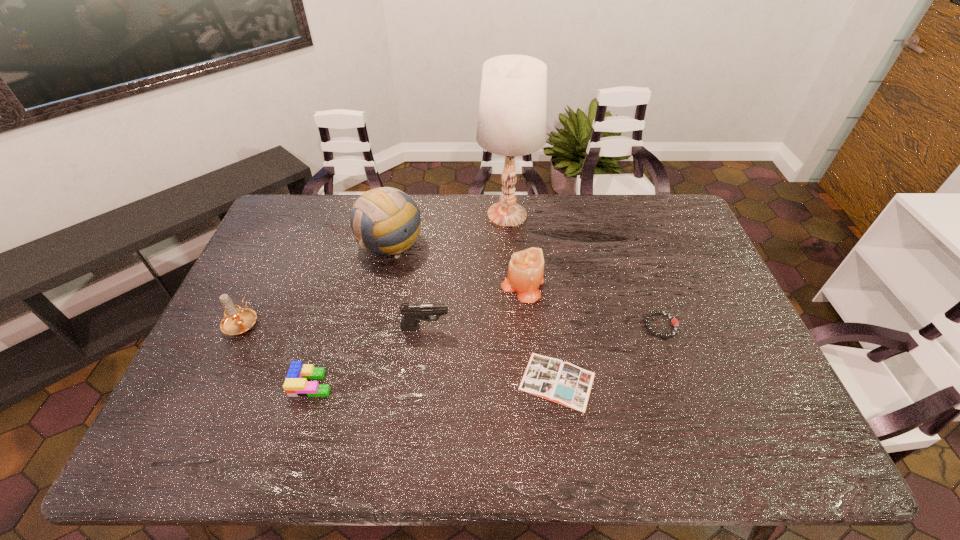
Where is `the tallest object`? The height and width of the screenshot is (540, 960). the tallest object is located at coordinates (512, 111).

At what (x,y) coordinates should I click in order to perform the action: click on volleyball. Please return your answer as a coordinate pair (x, y). The width and height of the screenshot is (960, 540). Looking at the image, I should click on (x=386, y=221).

This screenshot has height=540, width=960. In order to click on the right candle in this screenshot , I will do `click(525, 274)`.

Where is `the third farthest object`? the third farthest object is located at coordinates (525, 274).

Find the location of a particular element. Image resolution: width=960 pixels, height=540 pixels. the nearer candle is located at coordinates (237, 320).

This screenshot has height=540, width=960. Identify the location of the leftmost object. (237, 320).

This screenshot has width=960, height=540. In order to click on the fifth tallest object in this screenshot , I will do `click(413, 312)`.

Locate an element on the screen. This screenshot has width=960, height=540. the sixth tallest object is located at coordinates (296, 385).

You are a GUI agent. You are given a task and a screenshot of the screen. Output one action in this format:
    pyautogui.click(x=<x>, y=<y>)
    Task: Click on the rightmost object
    The height and width of the screenshot is (540, 960).
    Given the screenshot: What is the action you would take?
    pyautogui.click(x=674, y=321)

Image resolution: width=960 pixels, height=540 pixels. Find the location of `the second shortest object`. the second shortest object is located at coordinates (674, 321).